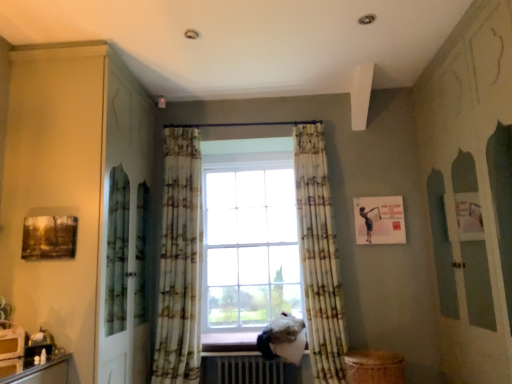
Describe the element at coordinates (249, 370) in the screenshot. Image resolution: width=512 pixels, height=384 pixels. I see `metallic silver radiator at lower center` at that location.

Describe the element at coordinates (180, 262) in the screenshot. The image size is (512, 384). I see `floral fabric curtain at center, acting as the second curtain starting from the right` at that location.

The width and height of the screenshot is (512, 384). I want to click on metallic silver radiator at lower center, so click(249, 370).

Based on the photo, is floral fabric curtain at center, acting as the second curtain starting from the right, wider than wooden at lower center?

No, floral fabric curtain at center, acting as the second curtain starting from the right, is not wider than wooden at lower center.

Are floral fabric curtain at center, acting as the second curtain starting from the right, and wooden at lower center far apart?

That's not correct — floral fabric curtain at center, acting as the second curtain starting from the right, is a little close to wooden at lower center.

Is point (170, 276) positioned before point (234, 333)?

Yes, it is.

The width and height of the screenshot is (512, 384). Find the location of `window sill behind the floral fabric curtain at center, the first curtain when ordered from left to right`. window sill behind the floral fabric curtain at center, the first curtain when ordered from left to right is located at coordinates (229, 342).

From the image's perspective, is wooden at lower center above floral fabric curtain at center, acting as the second curtain starting from the right?

Incorrect, from the image's perspective, wooden at lower center is lower than floral fabric curtain at center, acting as the second curtain starting from the right.

From a real-world perspective, is wooden at lower center physically located above or below floral fabric curtain at center, the first curtain when ordered from left to right?

In terms of real-world spatial position, wooden at lower center is below floral fabric curtain at center, the first curtain when ordered from left to right.

Is floral fabric curtain at center, the first curtain when ordered from left to right, at the back of wooden at lower center?

No, floral fabric curtain at center, the first curtain when ordered from left to right, is not at the back of wooden at lower center.

Between wooden at lower center and floral fabric curtain at center, the first curtain when ordered from left to right, which one has smaller width?

With smaller width is floral fabric curtain at center, the first curtain when ordered from left to right.

Does floral fabric curtain at center, the first curtain when ordered from left to right, have a larger size compared to metallic silver radiator at lower center?

Yes, floral fabric curtain at center, the first curtain when ordered from left to right, is bigger than metallic silver radiator at lower center.

Does point (183, 364) come closer to viewer compared to point (281, 379)?

That is True.

Is metallic silver radiator at lower center at the back of floral fabric curtain at center, acting as the second curtain starting from the right?

floral fabric curtain at center, acting as the second curtain starting from the right, is not turned away from metallic silver radiator at lower center.

Is floral fabric curtain at center, acting as the second curtain starting from the right, far from metallic silver radiator at lower center?

floral fabric curtain at center, acting as the second curtain starting from the right, is near metallic silver radiator at lower center, not far away.

Is metallic silver radiator at lower center next to floral fabric curtain at center, acting as the second curtain starting from the right?

There is a gap between metallic silver radiator at lower center and floral fabric curtain at center, acting as the second curtain starting from the right.

Is floral fabric curtain at center, the first curtain when ordered from left to right, located within metallic silver radiator at lower center?

No, floral fabric curtain at center, the first curtain when ordered from left to right, is not a part of metallic silver radiator at lower center.

From the image's perspective, would you say metallic silver radiator at lower center is shown under floral fabric curtain at center, the first curtain when ordered from left to right?

Yes, from the image's perspective, metallic silver radiator at lower center is beneath floral fabric curtain at center, the first curtain when ordered from left to right.

From a real-world perspective, relative to floral fabric curtain at center, acting as the second curtain starting from the right, is metallic silver radiator at lower center vertically above or below?

metallic silver radiator at lower center is below floral fabric curtain at center, acting as the second curtain starting from the right.

How far apart are floral fabric curtain at center, the first curtain from the right, and floral fabric curtain at center, acting as the second curtain starting from the right?

A distance of 1.02 meters exists between floral fabric curtain at center, the first curtain from the right, and floral fabric curtain at center, acting as the second curtain starting from the right.

Can you see floral fabric curtain at center, arranged as the second curtain when viewed from the left, touching floral fabric curtain at center, acting as the second curtain starting from the right?

No, floral fabric curtain at center, arranged as the second curtain when viewed from the left, is not in contact with floral fabric curtain at center, acting as the second curtain starting from the right.

Between floral fabric curtain at center, the first curtain from the right, and floral fabric curtain at center, the first curtain when ordered from left to right, which one appears on the left side from the viewer's perspective?

From the viewer's perspective, floral fabric curtain at center, the first curtain when ordered from left to right, appears more on the left side.

Can you tell me how much floral fabric curtain at center, the first curtain from the right, and floral fabric curtain at center, acting as the second curtain starting from the right, differ in facing direction?

There is a 4.46-degree angle between the facing directions of floral fabric curtain at center, the first curtain from the right, and floral fabric curtain at center, acting as the second curtain starting from the right.

From a real-world perspective, relative to floral fabric curtain at center, arranged as the second curtain when viewed from the left, is metallic silver radiator at lower center vertically above or below?

In terms of real-world spatial position, metallic silver radiator at lower center is below floral fabric curtain at center, arranged as the second curtain when viewed from the left.

Is metallic silver radiator at lower center completely or partially outside of floral fabric curtain at center, the first curtain from the right?

Yes, metallic silver radiator at lower center is not within floral fabric curtain at center, the first curtain from the right.

Is metallic silver radiator at lower center oriented towards floral fabric curtain at center, the first curtain from the right?

No.

Can you confirm if metallic silver radiator at lower center is smaller than floral fabric curtain at center, the first curtain from the right?

Indeed, metallic silver radiator at lower center has a smaller size compared to floral fabric curtain at center, the first curtain from the right.

Between floral fabric curtain at center, acting as the second curtain starting from the right, and floral fabric curtain at center, arranged as the second curtain when viewed from the left, which one appears on the right side from the viewer's perspective?

floral fabric curtain at center, arranged as the second curtain when viewed from the left.

From the image's perspective, which is below, floral fabric curtain at center, acting as the second curtain starting from the right, or floral fabric curtain at center, arranged as the second curtain when viewed from the left?

floral fabric curtain at center, acting as the second curtain starting from the right, appears lower in the image.

Does floral fabric curtain at center, the first curtain when ordered from left to right, touch floral fabric curtain at center, arranged as the second curtain when viewed from the left?

No.

Find the location of `curtain above the floral fabric curtain at center, acting as the second curtain starting from the right (from the image's perspective)`. curtain above the floral fabric curtain at center, acting as the second curtain starting from the right (from the image's perspective) is located at coordinates (319, 256).

Image resolution: width=512 pixels, height=384 pixels. I want to click on window sill below the floral fabric curtain at center, acting as the second curtain starting from the right (from a real-world perspective), so click(x=229, y=342).

From a real-world perspective, starting from the wooden at lower center, which curtain is the 2nd one vertically above it? Please provide its 2D coordinates.

[(180, 262)]

Based on their spatial positions, is floral fabric curtain at center, the first curtain from the right, or metallic silver radiator at lower center closer to floral fabric curtain at center, acting as the second curtain starting from the right?

metallic silver radiator at lower center is closer to floral fabric curtain at center, acting as the second curtain starting from the right.

When comparing their distances from floral fabric curtain at center, arranged as the second curtain when viewed from the left, does floral fabric curtain at center, acting as the second curtain starting from the right, or wooden at lower center seem closer?

floral fabric curtain at center, acting as the second curtain starting from the right, lies closer to floral fabric curtain at center, arranged as the second curtain when viewed from the left, than the other object.

When comparing their distances from floral fabric curtain at center, acting as the second curtain starting from the right, does wooden at lower center or metallic silver radiator at lower center seem closer?

metallic silver radiator at lower center.

Which object lies nearer to the anchor point floral fabric curtain at center, arranged as the second curtain when viewed from the left, wooden at lower center or metallic silver radiator at lower center?

The object closer to floral fabric curtain at center, arranged as the second curtain when viewed from the left, is metallic silver radiator at lower center.

Consider the image. Based on their spatial positions, is floral fabric curtain at center, acting as the second curtain starting from the right, or wooden at lower center closer to metallic silver radiator at lower center?

wooden at lower center is positioned closer to the anchor metallic silver radiator at lower center.

Which object lies further to the anchor point wooden at lower center, floral fabric curtain at center, acting as the second curtain starting from the right, or floral fabric curtain at center, arranged as the second curtain when viewed from the left?

The object further to wooden at lower center is floral fabric curtain at center, arranged as the second curtain when viewed from the left.

Based on their spatial positions, is metallic silver radiator at lower center or floral fabric curtain at center, acting as the second curtain starting from the right, further from floral fabric curtain at center, arranged as the second curtain when viewed from the left?

Based on the image, floral fabric curtain at center, acting as the second curtain starting from the right, appears to be further to floral fabric curtain at center, arranged as the second curtain when viewed from the left.

Consider the image. When comparing their distances from floral fabric curtain at center, the first curtain from the right, does metallic silver radiator at lower center or wooden at lower center seem closer?

Based on the image, metallic silver radiator at lower center appears to be nearer to floral fabric curtain at center, the first curtain from the right.

Where is `window sill between floral fabric curtain at center, arranged as the second curtain when viewed from the left, and metallic silver radiator at lower center in the up-down direction`? This screenshot has width=512, height=384. window sill between floral fabric curtain at center, arranged as the second curtain when viewed from the left, and metallic silver radiator at lower center in the up-down direction is located at coordinates (229, 342).

The image size is (512, 384). I want to click on window sill between floral fabric curtain at center, acting as the second curtain starting from the right, and floral fabric curtain at center, arranged as the second curtain when viewed from the left, in the horizontal direction, so click(229, 342).

Identify the location of window sill between floral fabric curtain at center, acting as the second curtain starting from the right, and metallic silver radiator at lower center from top to bottom. The height and width of the screenshot is (384, 512). (229, 342).

Locate an element on the screen. curtain between floral fabric curtain at center, arranged as the second curtain when viewed from the left, and metallic silver radiator at lower center from top to bottom is located at coordinates [180, 262].